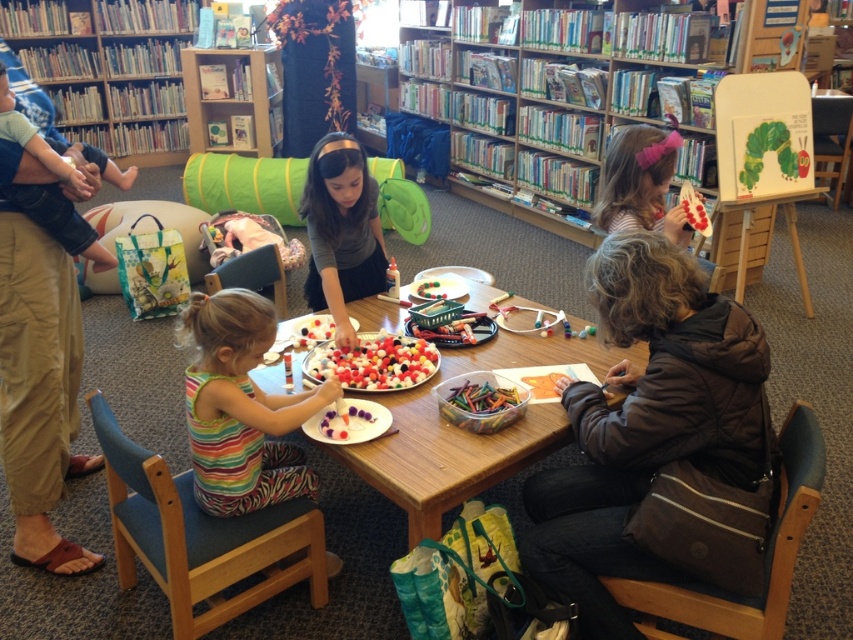
The height and width of the screenshot is (640, 853). What do you see at coordinates (544, 90) in the screenshot? I see `wooden bookshelf at upper center` at bounding box center [544, 90].

In the scene shown: Between wooden bookshelf at upper center and brown cotton pants at left, which one has more height?

wooden bookshelf at upper center

Find the location of a particular element. wooden bookshelf at upper center is located at coordinates (544, 90).

Which is behind, point (361, 148) or point (669, 230)?

Positioned behind is point (361, 148).

In the scene shown: Does matte gray shirt at center appear under matte pink hairband at upper right?

No, matte gray shirt at center is not below matte pink hairband at upper right.

Is point (314, 300) less distant than point (631, 221)?

No, (314, 300) is further to viewer.

Locate an element on the screen. matte gray shirt at center is located at coordinates (341, 230).

Describe the element at coordinates (648, 432) in the screenshot. I see `brown fuzzy jacket at lower right` at that location.

Where is `brown fuzzy jacket at lower right`? brown fuzzy jacket at lower right is located at coordinates (648, 432).

Is point (564, 396) positioned in front of point (526, 70)?

Yes, point (564, 396) is in front of point (526, 70).

Find the location of a particular element. This screenshot has width=853, height=640. brown fuzzy jacket at lower right is located at coordinates (648, 432).